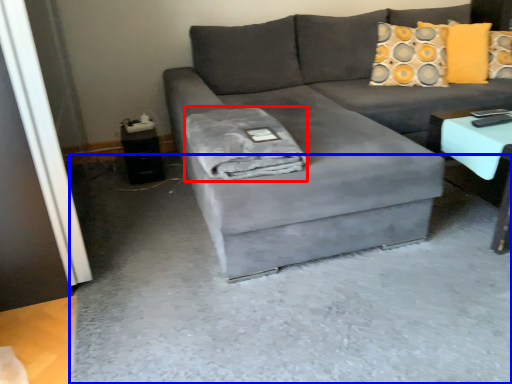
Question: Which of the following is the farthest to the observer, material (highlighted by a red box) or concrete (highlighted by a blue box)?

Choices:
 (A) material
 (B) concrete

Answer: (A)